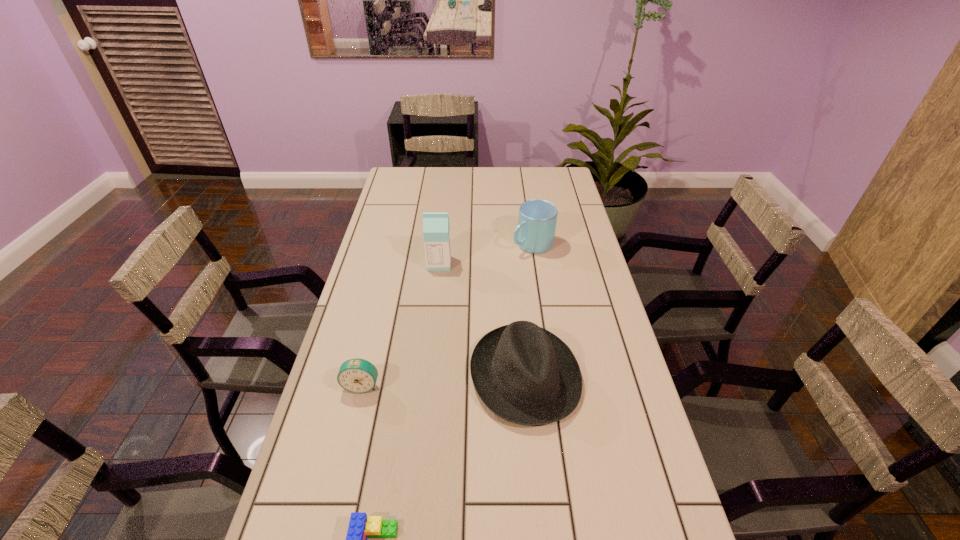
This screenshot has height=540, width=960. I want to click on mug that is at the right edge, so click(535, 233).

At what (x,y) coordinates should I click in order to perform the action: click on fedora present at the right edge. Please return your answer as a coordinate pair (x, y). Looking at the image, I should click on (526, 375).

At what (x,y) coordinates should I click in order to perform the action: click on free space at the far edge of the desktop. Please return your answer as a coordinate pair (x, y). Looking at the image, I should click on (521, 169).

At what (x,y) coordinates should I click in order to perform the action: click on vacant area at the left edge of the desktop. Please return your answer as a coordinate pair (x, y). Looking at the image, I should click on (371, 465).

In the image, there is a desktop. Where is `vacant space at the right edge`? vacant space at the right edge is located at coordinates (584, 219).

In the image, there is a desktop. At what (x,y) coordinates should I click in order to perform the action: click on vacant space at the far left corner. Please return your answer as a coordinate pair (x, y). Looking at the image, I should click on (404, 179).

This screenshot has width=960, height=540. I want to click on empty space between the milk carton and the mug, so click(486, 254).

I want to click on vacant area that lies between the mug and the milk carton, so click(x=486, y=254).

Find the location of a particular element. empty space that is in between the fedora and the milk carton is located at coordinates (482, 320).

Identify which object is the second closest to the milk carton. Please provide its 2D coordinates. Your answer should be formatted as a tuple, i.e. [(x, y)], where the tuple contains the x and y coordinates of a point satisfying the conditions above.

[(526, 375)]